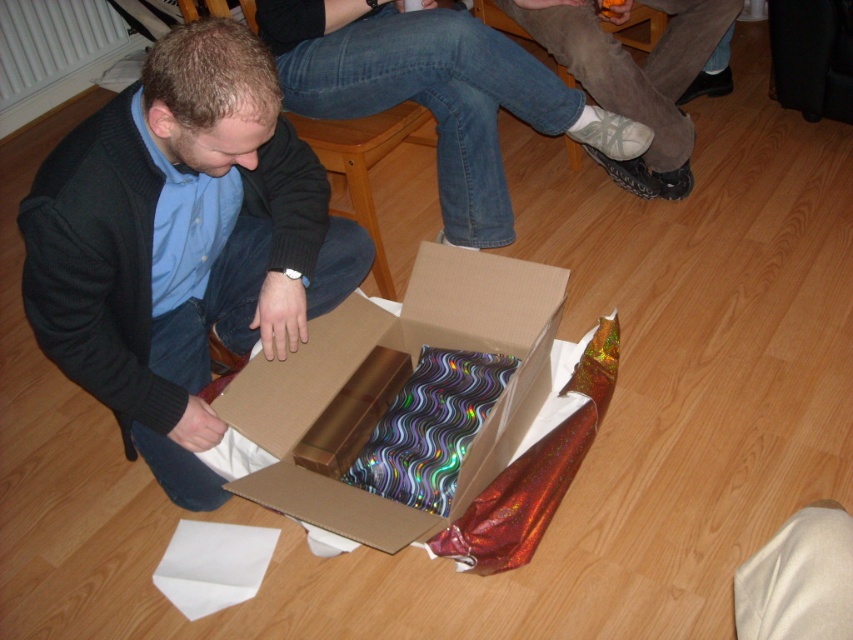
Between matte black sweater at lower left and cardboard box at lower center, which one appears on the left side from the viewer's perspective?

Positioned to the left is matte black sweater at lower left.

Does matte black sweater at lower left appear on the left side of cardboard box at lower center?

Correct, you'll find matte black sweater at lower left to the left of cardboard box at lower center.

Locate an element on the screen. This screenshot has height=640, width=853. matte black sweater at lower left is located at coordinates (181, 243).

In order to click on matte black sweater at lower left in this screenshot , I will do `click(181, 243)`.

Is cardboard box at lower center closer to the viewer compared to white mesh socks at lower center?

Yes, it is in front of white mesh socks at lower center.

Does cardboard box at lower center appear on the left side of white mesh socks at lower center?

Indeed, cardboard box at lower center is positioned on the left side of white mesh socks at lower center.

Describe the element at coordinates (413, 364) in the screenshot. I see `cardboard box at lower center` at that location.

Where is `cardboard box at lower center`? This screenshot has width=853, height=640. cardboard box at lower center is located at coordinates (413, 364).

Which is in front, point (192, 38) or point (682, 186)?

Point (192, 38) is more forward.

What do you see at coordinates (181, 243) in the screenshot?
I see `matte black sweater at lower left` at bounding box center [181, 243].

The image size is (853, 640). I want to click on matte black sweater at lower left, so click(181, 243).